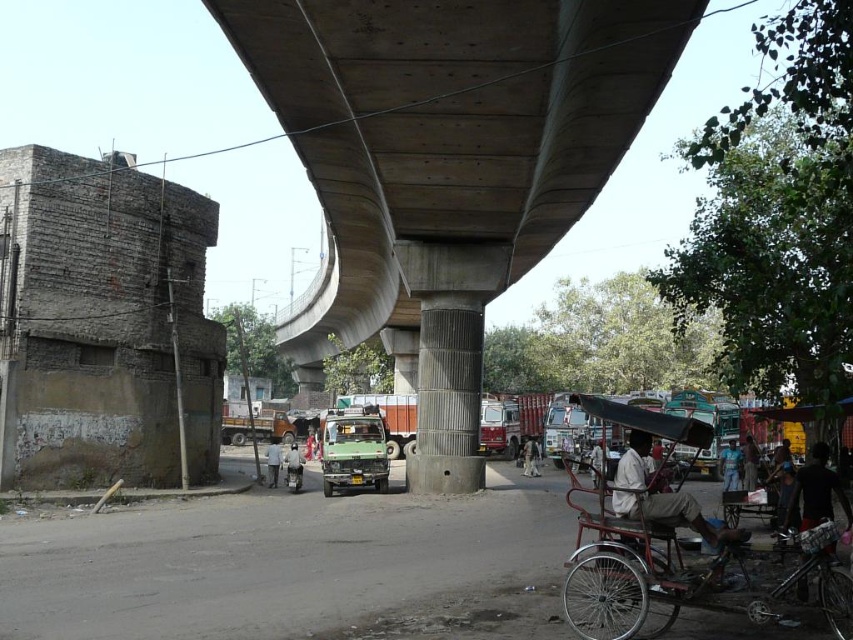
Question: Does concrete at center have a larger size compared to light blue shirt at center?

Choices:
 (A) yes
 (B) no

Answer: (A)

Question: Which of the following is the closest to the observer?

Choices:
 (A) white fabric at center
 (B) concrete at center
 (C) blue fabric person at lower right
 (D) concrete textured column at center

Answer: (B)

Question: Estimate the real-world distances between objects in this image. Which object is closer to the light blue shirt at center?

Choices:
 (A) metallic red rickshaw at lower right
 (B) white fabric at center

Answer: (B)

Question: Which point appears farthest from the camera in this image?

Choices:
 (A) (532, 448)
 (B) (601, 456)
 (C) (410, 468)
 (D) (287, 454)

Answer: (A)

Question: Does concrete textured column at center appear under light blue shirt at center?

Choices:
 (A) yes
 (B) no

Answer: (B)

Question: In this image, where is dark blue fabric shirt at lower right located relative to light gray fabric rickshaw at center?

Choices:
 (A) below
 (B) above

Answer: (B)